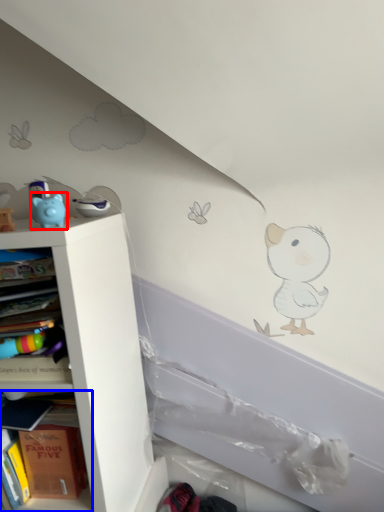
Question: Which point is closer to the camera, toy (highlighted by a red box) or shelf (highlighted by a blue box)?

Choices:
 (A) toy
 (B) shelf

Answer: (A)